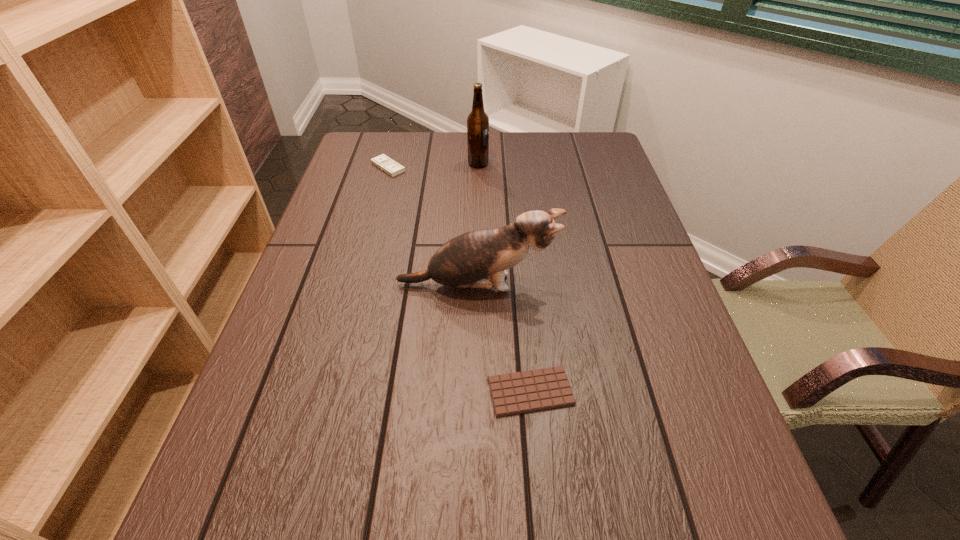
At what (x,y) coordinates should I click in order to perform the action: click on vacant point located on the right of the shortest object. Please return your answer as a coordinate pair (x, y). The image size is (960, 540). Looking at the image, I should click on (678, 392).

Where is `beer bottle that is positioned at the far edge`? The width and height of the screenshot is (960, 540). beer bottle that is positioned at the far edge is located at coordinates (477, 121).

In order to click on money located in the far edge section of the desktop in this screenshot , I will do `click(383, 162)`.

I want to click on object present at the left edge, so click(x=383, y=162).

Where is `object present at the far left corner`? The image size is (960, 540). object present at the far left corner is located at coordinates (383, 162).

At what (x,y) coordinates should I click in order to perform the action: click on free space at the far edge of the desktop. Please return your answer as a coordinate pair (x, y). Looking at the image, I should click on (434, 146).

This screenshot has height=540, width=960. In the image, there is a desktop. Find the location of `vacant area at the left edge`. vacant area at the left edge is located at coordinates (250, 458).

Where is `free space at the right edge of the desktop`? free space at the right edge of the desktop is located at coordinates (662, 271).

This screenshot has height=540, width=960. What are the coordinates of `free location at the far left corner of the desktop` in the screenshot? It's located at (370, 153).

You are a GUI agent. You are given a task and a screenshot of the screen. Output one action in this format:
    pyautogui.click(x=<x>, y=<y>)
    Task: Click on the vacant position at the far right corner of the desktop
    The height and width of the screenshot is (540, 960).
    Given the screenshot: What is the action you would take?
    pyautogui.click(x=561, y=144)